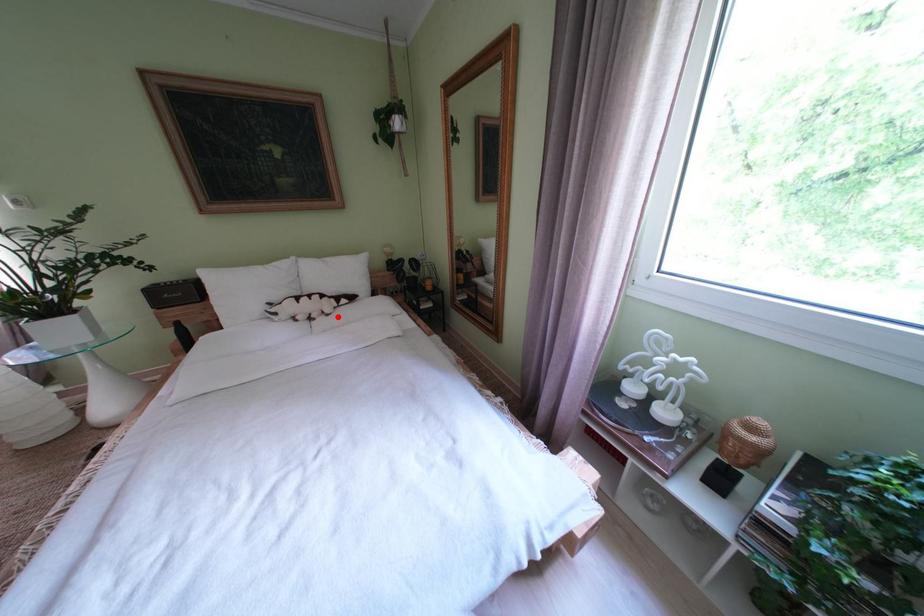
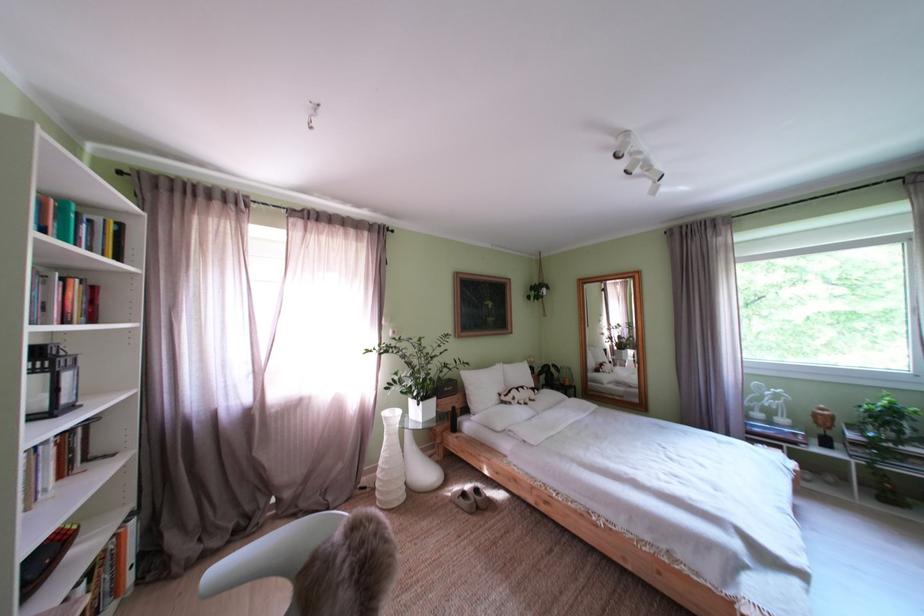
Where in the second image is the point corresponding to the highlighted location from the first image?

(543, 403)